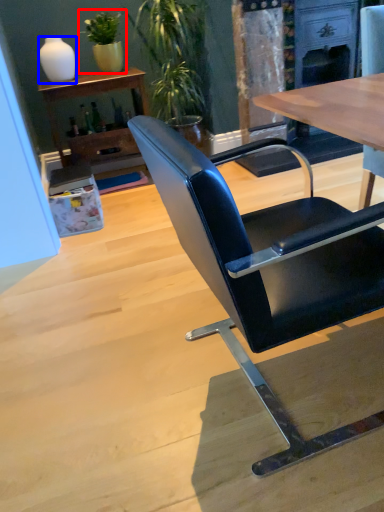
Question: Among these objects, which one is nearest to the camera, houseplant (highlighted by a red box) or vase (highlighted by a blue box)?

Choices:
 (A) houseplant
 (B) vase

Answer: (B)